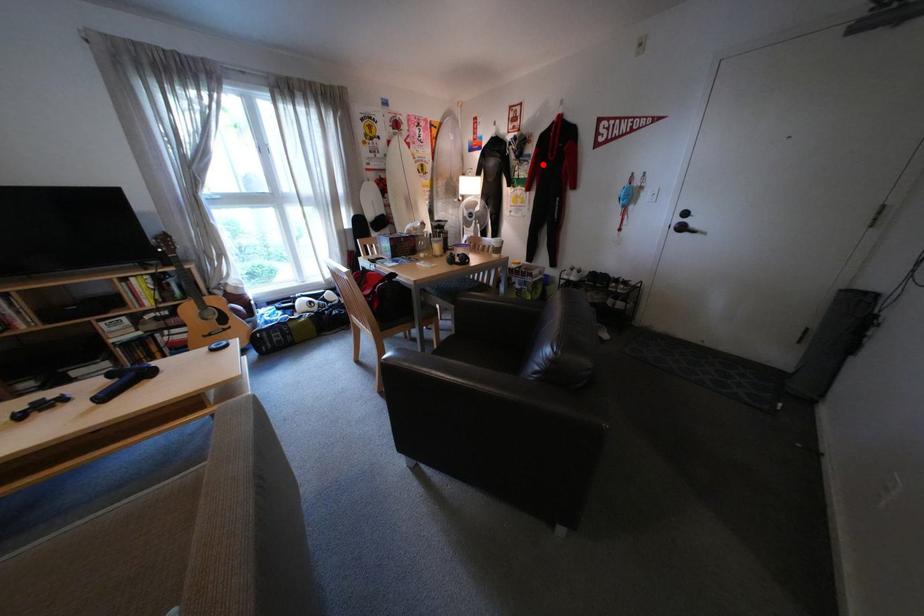
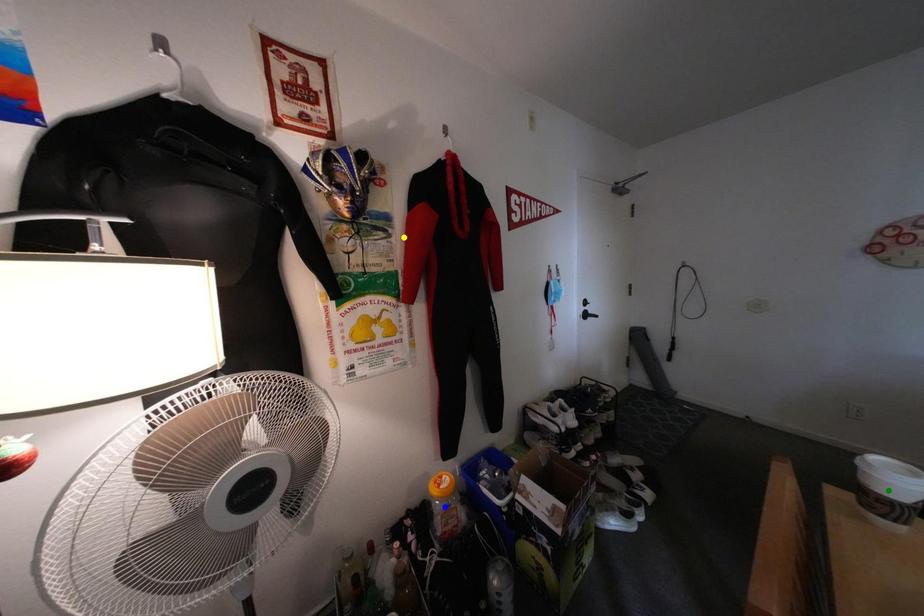
Question: I am providing you with two images of the same scene from different viewpoints. A red point is marked on the first image. You are given multiple points on the second image. Which spot in image 2 lines up with the point in image 1?

Choices:
 (A) blue point
 (B) green point
 (C) yellow point

Answer: (C)